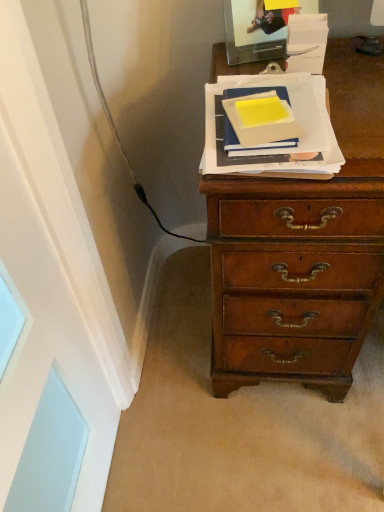
Question: Which direction should I rotate to look at blue matte book at center, the second paperback book viewed from the left, — up or down?

Choices:
 (A) down
 (B) up

Answer: (B)

Question: Does blue matte book at center, the second paperback book viewed from the left, lie behind matte yellow paper at upper center, the second paperback book positioned from the right?

Choices:
 (A) no
 (B) yes

Answer: (A)

Question: Is blue matte book at center, which is the first paperback book from right to left, aimed at matte yellow paper at upper center, placed as the first paperback book when sorted from left to right?

Choices:
 (A) yes
 (B) no

Answer: (B)

Question: Considering the relative sizes of blue matte book at center, the second paperback book viewed from the left, and matte yellow paper at upper center, placed as the first paperback book when sorted from left to right, in the image provided, is blue matte book at center, the second paperback book viewed from the left, wider than matte yellow paper at upper center, placed as the first paperback book when sorted from left to right,?

Choices:
 (A) no
 (B) yes

Answer: (B)

Question: Is matte yellow paper at upper center, placed as the first paperback book when sorted from left to right, completely or partially inside blue matte book at center, which is the first paperback book from right to left?

Choices:
 (A) no
 (B) yes

Answer: (B)

Question: From the image's perspective, is blue matte book at center, which is the first paperback book from right to left, located beneath matte yellow paper at upper center, placed as the first paperback book when sorted from left to right?

Choices:
 (A) yes
 (B) no

Answer: (A)

Question: From a real-world perspective, is blue matte book at center, the second paperback book viewed from the left, over matte yellow paper at upper center, placed as the first paperback book when sorted from left to right?

Choices:
 (A) no
 (B) yes

Answer: (A)

Question: From a real-world perspective, is matte yellow paper at upper center, the second paperback book positioned from the right, physically below blue matte book at center, which is the first paperback book from right to left?

Choices:
 (A) yes
 (B) no

Answer: (B)

Question: Can you confirm if matte yellow paper at upper center, placed as the first paperback book when sorted from left to right, is taller than blue matte book at center, which is the first paperback book from right to left?

Choices:
 (A) yes
 (B) no

Answer: (A)

Question: Does matte yellow paper at upper center, the second paperback book positioned from the right, have a lesser height compared to blue matte book at center, which is the first paperback book from right to left?

Choices:
 (A) no
 (B) yes

Answer: (A)

Question: Can you confirm if matte yellow paper at upper center, the second paperback book positioned from the right, is thinner than blue matte book at center, which is the first paperback book from right to left?

Choices:
 (A) yes
 (B) no

Answer: (A)

Question: Is matte yellow paper at upper center, the second paperback book positioned from the right, bigger than blue matte book at center, the second paperback book viewed from the left?

Choices:
 (A) no
 (B) yes

Answer: (A)

Question: From the image's perspective, is matte yellow paper at upper center, the second paperback book positioned from the right, above blue matte book at center, which is the first paperback book from right to left?

Choices:
 (A) no
 (B) yes

Answer: (B)

Question: Is blue matte book at center, the second paperback book viewed from the left, in front of or behind matte yellow paper at upper center, the second paperback book positioned from the right, in the image?

Choices:
 (A) behind
 (B) front

Answer: (B)